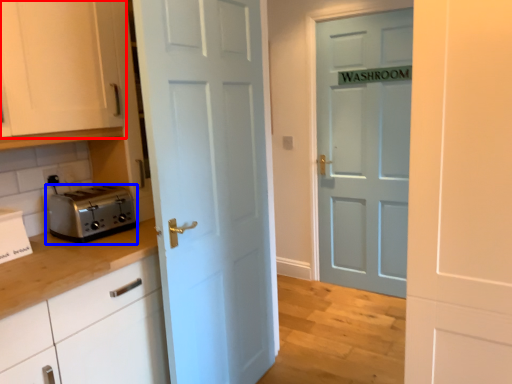
Question: Among these objects, which one is farthest to the camera, cabinetry (highlighted by a red box) or toaster (highlighted by a blue box)?

Choices:
 (A) cabinetry
 (B) toaster

Answer: (B)